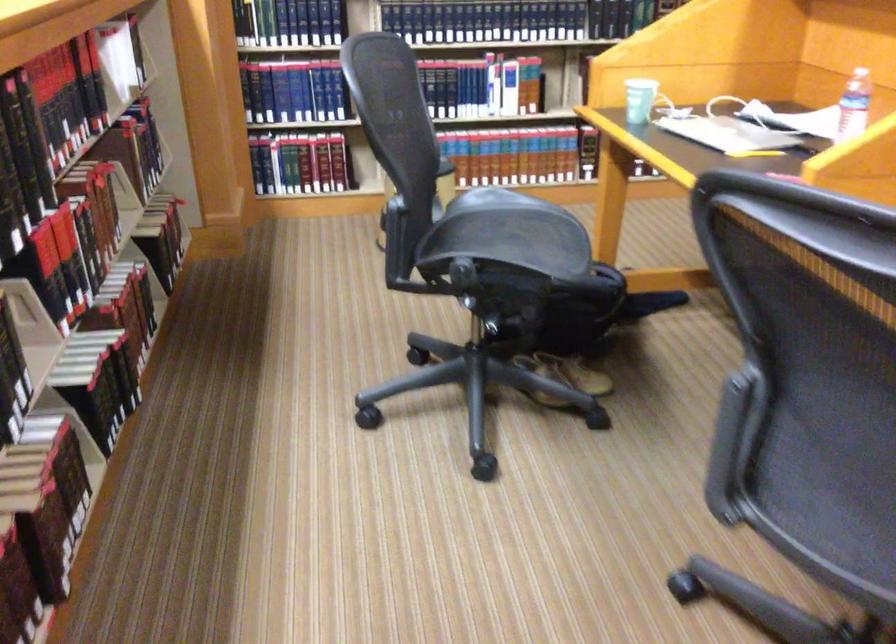
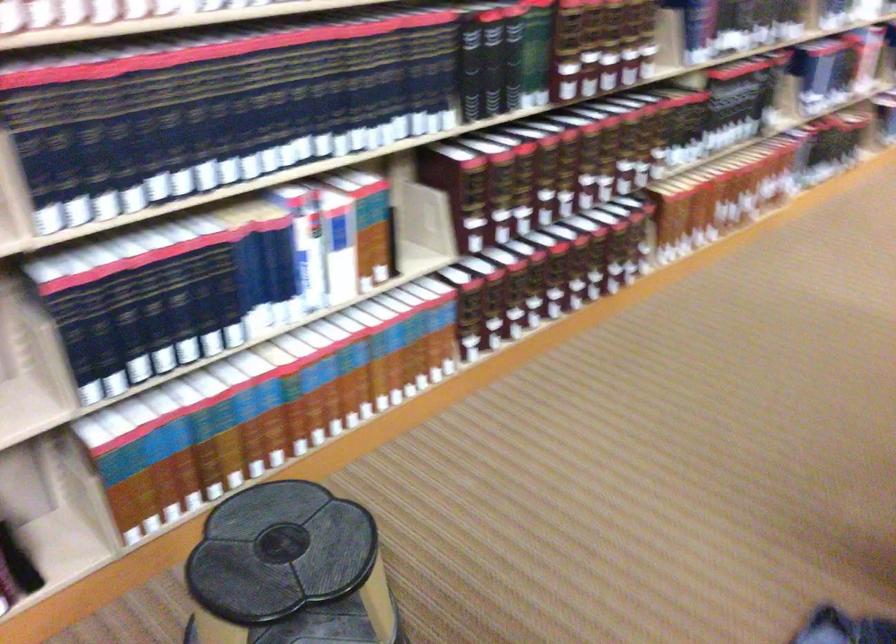
The point at (x=440, y=84) is marked in the first image. Where is the corresponding point in the second image?

(200, 290)